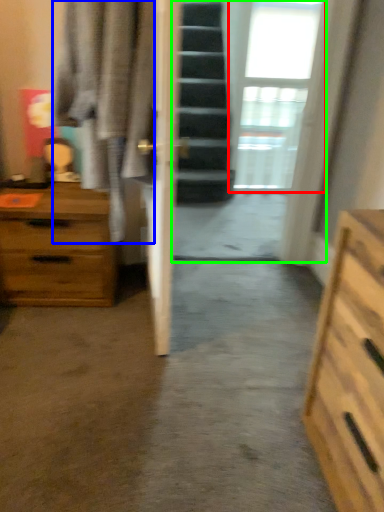
Question: Which object is the closest to the window (highlighted by a red box)? Choose among these: robe (highlighted by a blue box) or glass door (highlighted by a green box).

Choices:
 (A) robe
 (B) glass door

Answer: (B)